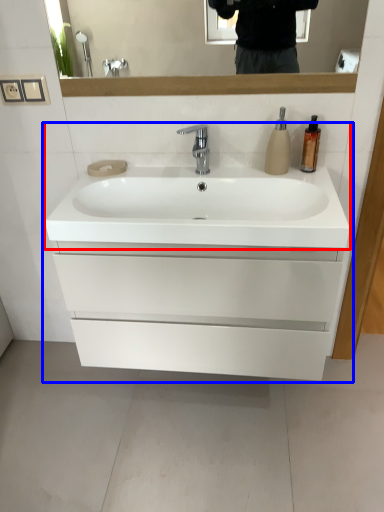
Question: Among these objects, which one is nearest to the camera, sink (highlighted by a red box) or bathroom cabinet (highlighted by a blue box)?

Choices:
 (A) sink
 (B) bathroom cabinet

Answer: (A)